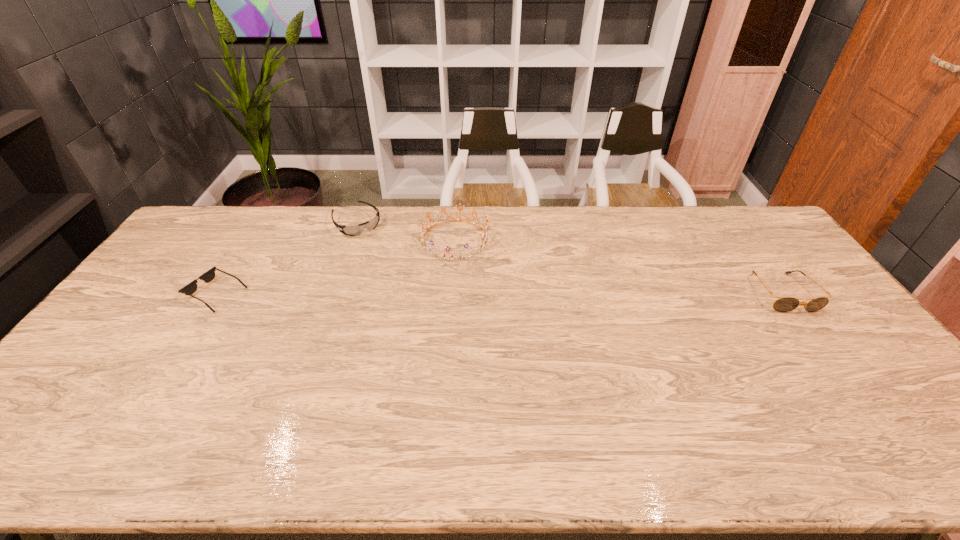
Find the location of a particular element. Image resolution: width=960 pixels, height=540 pixels. object that is at the right edge is located at coordinates (785, 304).

Where is `vacant space at the far edge of the desktop`? Image resolution: width=960 pixels, height=540 pixels. vacant space at the far edge of the desktop is located at coordinates (557, 209).

Find the location of a particular element. This screenshot has height=540, width=960. free space at the near edge of the desktop is located at coordinates (488, 418).

You are a GUI agent. You are given a task and a screenshot of the screen. Output one action in this format:
    pyautogui.click(x=<x>, y=<y>)
    Task: Click on the blank space at the left edge of the desktop
    This screenshot has height=540, width=960.
    Given the screenshot: What is the action you would take?
    pyautogui.click(x=126, y=365)

In the image, there is a desktop. At what (x,y) coordinates should I click in order to perform the action: click on vacant space at the near right corner. Please return your answer as a coordinate pair (x, y). Image resolution: width=960 pixels, height=540 pixels. Looking at the image, I should click on (918, 410).

At what (x,y) coordinates should I click in order to perform the action: click on free point between the shortest sunglasses and the tallest sunglasses. Please return your answer as a coordinate pair (x, y). The image size is (960, 540). Looking at the image, I should click on (499, 293).

Where is `vacant area that lies between the leftmost object and the second object from right to left`? Image resolution: width=960 pixels, height=540 pixels. vacant area that lies between the leftmost object and the second object from right to left is located at coordinates (336, 267).

This screenshot has height=540, width=960. What are the coordinates of `free spot between the second object from right to left and the tallest sunglasses` in the screenshot? It's located at (618, 266).

Where is `blank region between the tallest sunglasses and the second object from left to right`? This screenshot has width=960, height=540. blank region between the tallest sunglasses and the second object from left to right is located at coordinates (569, 258).

Where is `empty space between the second sunglasses from left to right and the second object from right to left`? The width and height of the screenshot is (960, 540). empty space between the second sunglasses from left to right and the second object from right to left is located at coordinates (406, 231).